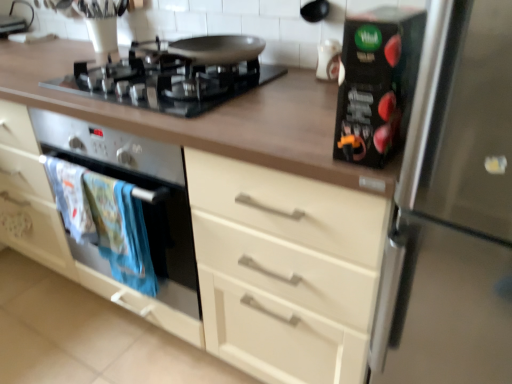
Describe the element at coordinates (166, 83) in the screenshot. I see `black glass gas stove at upper center` at that location.

What do you see at coordinates (328, 60) in the screenshot? I see `white glossy vase at upper center, the first appliance when ordered from back to front` at bounding box center [328, 60].

In the scene shown: What is the approximate height of stainless steel refrigerator at right?

stainless steel refrigerator at right is 1.16 meters tall.

Describe the element at coordinates (91, 244) in the screenshot. I see `matte black oven at left` at that location.

This screenshot has height=384, width=512. In order to click on black glass gas stove at upper center in this screenshot , I will do `click(166, 83)`.

Which of these two, black glass gas stove at upper center or white glossy vase at upper center, the first appliance when ordered from back to front, stands taller?

white glossy vase at upper center, the first appliance when ordered from back to front.

From a real-world perspective, who is located higher, black glass gas stove at upper center or white glossy vase at upper center, marked as the second appliance in a bottom-to-top arrangement?

white glossy vase at upper center, marked as the second appliance in a bottom-to-top arrangement.

Considering the relative positions of black glass gas stove at upper center and white glossy vase at upper center, which is the 2th appliance in front-to-back order, in the image provided, is black glass gas stove at upper center to the left or to the right of white glossy vase at upper center, which is the 2th appliance in front-to-back order,?

black glass gas stove at upper center is to the left of white glossy vase at upper center, which is the 2th appliance in front-to-back order.

Based on the photo, considering the sizes of objects black glass gas stove at upper center and white glossy vase at upper center, the first appliance when ordered from back to front, in the image provided, who is bigger, black glass gas stove at upper center or white glossy vase at upper center, the first appliance when ordered from back to front,?

Bigger between the two is black glass gas stove at upper center.

Would you say black glass gas stove at upper center is inside or outside black glossy box at upper right, which ranks as the 1th appliance in bottom-to-top order?

black glass gas stove at upper center lies outside black glossy box at upper right, which ranks as the 1th appliance in bottom-to-top order.

Find the location of a particular element. This screenshot has height=384, width=512. appliance below the black glass gas stove at upper center (from the image's perspective) is located at coordinates pos(377,83).

Is black glass gas stove at upper center next to black glossy box at upper right, the 2th appliance when ordered from back to front?

No, black glass gas stove at upper center is not with black glossy box at upper right, the 2th appliance when ordered from back to front.

Considering the sizes of black glass gas stove at upper center and black glossy box at upper right, the 2th appliance when ordered from back to front, in the image, is black glass gas stove at upper center wider or thinner than black glossy box at upper right, the 2th appliance when ordered from back to front,?

Clearly, black glass gas stove at upper center has more width compared to black glossy box at upper right, the 2th appliance when ordered from back to front.

Consider the image. Between white glossy vase at upper center, which is the 2th appliance in front-to-back order, and matte black oven at left, which one is positioned behind?

white glossy vase at upper center, which is the 2th appliance in front-to-back order, is more distant.

Does white glossy vase at upper center, which is the 2th appliance in front-to-back order, turn towards matte black oven at left?

No, white glossy vase at upper center, which is the 2th appliance in front-to-back order, is not aimed at matte black oven at left.

Is white glossy vase at upper center, marked as the second appliance in a bottom-to-top arrangement, not near black glass gas stove at upper center?

They are positioned close to each other.

Is white glossy vase at upper center, which is the 2th appliance in front-to-back order, turned away from black glass gas stove at upper center?

No, white glossy vase at upper center, which is the 2th appliance in front-to-back order, is not facing away from black glass gas stove at upper center.

Can we say matte black oven at left lies outside black glass gas stove at upper center?

Yes, matte black oven at left is outside of black glass gas stove at upper center.

From the image's perspective, is matte black oven at left over black glass gas stove at upper center?

No, from the image's perspective, matte black oven at left is not above black glass gas stove at upper center.

Measure the distance from matte black oven at left to black glass gas stove at upper center.

The distance of matte black oven at left from black glass gas stove at upper center is 13.83 inches.

Is matte black oven at left at the left side of black glass gas stove at upper center?

Correct, you'll find matte black oven at left to the left of black glass gas stove at upper center.

Can you tell me how much black glass gas stove at upper center and stainless steel refrigerator at right differ in facing direction?

The facing directions of black glass gas stove at upper center and stainless steel refrigerator at right are 0.000108 degrees apart.

Is black glass gas stove at upper center facing towards stainless steel refrigerator at right?

No, black glass gas stove at upper center is not aimed at stainless steel refrigerator at right.

Looking at this image, relative to stainless steel refrigerator at right, is black glass gas stove at upper center in front or behind?

In the image, black glass gas stove at upper center appears behind stainless steel refrigerator at right.

Can you confirm if black glass gas stove at upper center is shorter than stainless steel refrigerator at right?

Yes, black glass gas stove at upper center is shorter than stainless steel refrigerator at right.

How different are the orientations of white glossy vase at upper center, marked as the second appliance in a bottom-to-top arrangement, and stainless steel refrigerator at right in degrees?

There is a 0.000344-degree angle between the facing directions of white glossy vase at upper center, marked as the second appliance in a bottom-to-top arrangement, and stainless steel refrigerator at right.

In the scene shown: Considering the relative positions of white glossy vase at upper center, marked as the second appliance in a bottom-to-top arrangement, and stainless steel refrigerator at right in the image provided, is white glossy vase at upper center, marked as the second appliance in a bottom-to-top arrangement, to the left or to the right of stainless steel refrigerator at right?

From the image, it's evident that white glossy vase at upper center, marked as the second appliance in a bottom-to-top arrangement, is to the left of stainless steel refrigerator at right.

From the picture: From the image's perspective, is white glossy vase at upper center, the first appliance when ordered from top to bottom, over stainless steel refrigerator at right?

Yes, from the image's perspective, white glossy vase at upper center, the first appliance when ordered from top to bottom, is above stainless steel refrigerator at right.

Choose the correct answer: Is white glossy vase at upper center, the first appliance when ordered from back to front, inside stainless steel refrigerator at right or outside it?

white glossy vase at upper center, the first appliance when ordered from back to front, cannot be found inside stainless steel refrigerator at right.

At what (x,y) coordinates should I click in order to perform the action: click on the 2nd appliance to the right of the black glass gas stove at upper center, starting your count from the anchor. Please return your answer as a coordinate pair (x, y). The height and width of the screenshot is (384, 512). Looking at the image, I should click on 328,60.

This screenshot has width=512, height=384. Identify the location of gas stove on the left of black glossy box at upper right, arranged as the first appliance when viewed from the front. (166, 83).

Estimate the real-world distances between objects in this image. Which object is closer to black glass gas stove at upper center, white glossy vase at upper center, which is the 2th appliance in front-to-back order, or stainless steel refrigerator at right?

white glossy vase at upper center, which is the 2th appliance in front-to-back order.

When comparing their distances from stainless steel refrigerator at right, does black glossy box at upper right, arranged as the first appliance when viewed from the front, or white fabric towels at lower left seem further?

The object further to stainless steel refrigerator at right is white fabric towels at lower left.

From the image, which object appears to be farther from black glossy box at upper right, which ranks as the 1th appliance in bottom-to-top order, matte black oven at left or black glass gas stove at upper center?

matte black oven at left is further to black glossy box at upper right, which ranks as the 1th appliance in bottom-to-top order.

Estimate the real-world distances between objects in this image. Which object is closer to black glass gas stove at upper center, white fabric towels at lower left or white glossy vase at upper center, marked as the second appliance in a bottom-to-top arrangement?

white fabric towels at lower left is positioned closer to the anchor black glass gas stove at upper center.

Consider the image. From the image, which object appears to be farther from black glossy box at upper right, placed as the 2th appliance when sorted from top to bottom, stainless steel refrigerator at right or white glossy vase at upper center, the first appliance when ordered from back to front?

white glossy vase at upper center, the first appliance when ordered from back to front, is further to black glossy box at upper right, placed as the 2th appliance when sorted from top to bottom.

Based on their spatial positions, is white fabric towels at lower left or black glass gas stove at upper center closer to matte black oven at left?

The object closer to matte black oven at left is white fabric towels at lower left.

Looking at the image, which one is located further to stainless steel refrigerator at right, white glossy vase at upper center, the first appliance when ordered from back to front, or black glossy box at upper right, the 2th appliance when ordered from back to front?

white glossy vase at upper center, the first appliance when ordered from back to front.

Which object lies nearer to the anchor point matte black oven at left, white glossy vase at upper center, the first appliance when ordered from top to bottom, or stainless steel refrigerator at right?

Based on the image, stainless steel refrigerator at right appears to be nearer to matte black oven at left.

Where is `gas stove between white fabric towels at lower left and white glossy vase at upper center, marked as the second appliance in a bottom-to-top arrangement, in the horizontal direction`? The width and height of the screenshot is (512, 384). gas stove between white fabric towels at lower left and white glossy vase at upper center, marked as the second appliance in a bottom-to-top arrangement, in the horizontal direction is located at coordinates (166, 83).

Identify the location of gas stove between stainless steel refrigerator at right and white glossy vase at upper center, marked as the second appliance in a bottom-to-top arrangement, from front to back. The width and height of the screenshot is (512, 384). (166, 83).

What are the coordinates of `gas stove between matte black oven at left and stainless steel refrigerator at right` in the screenshot? It's located at (166, 83).

Locate an element on the screen. Image resolution: width=512 pixels, height=384 pixels. gas stove between black glossy box at upper right, placed as the 2th appliance when sorted from top to bottom, and white glossy vase at upper center, the first appliance when ordered from top to bottom, in the front-back direction is located at coordinates (166, 83).